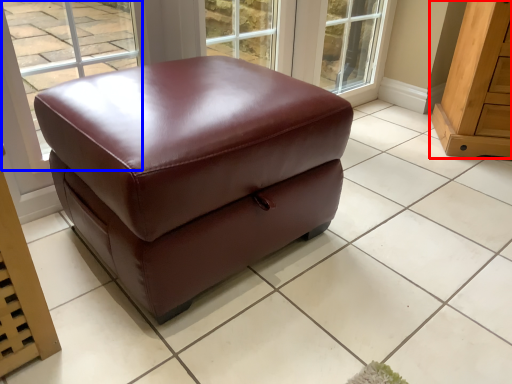
Question: Among these objects, which one is farthest to the camera, furniture (highlighted by a red box) or window (highlighted by a blue box)?

Choices:
 (A) furniture
 (B) window

Answer: (A)